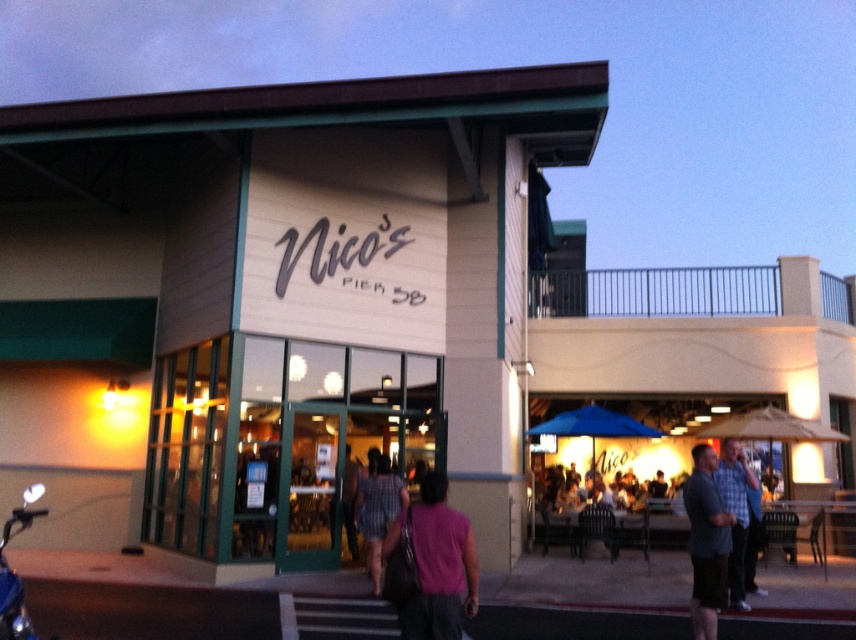
You are a delivery person arriving at Nico s Pier 38. You see a plaid fabric shirt at center and a shiny blue motorcycle at lower left. Where should you park your motorcycle so it doesn t block the entrance?

You should park the shiny blue motorcycle at lower left behind the plaid fabric shirt at center to avoid blocking the entrance.

You are a photographer standing outside Nico s Pier 38 restaurant. You notice two people wearing different shirts in the scene. The first is wearing a matte gray shirt at center, and the second is wearing a plaid shirt at center. Which person is shorter?

The matte gray shirt at center has a lesser height compared to the plaid shirt at center, so the person wearing the matte gray shirt at center is shorter.